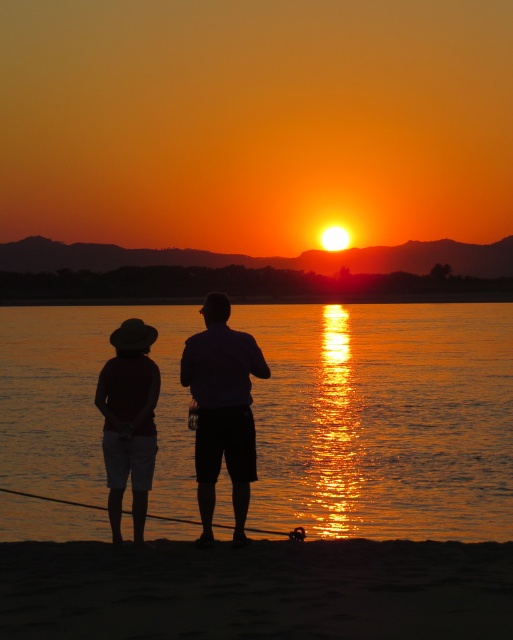
Question: Does matte black hat at lower left appear under metallic wire fishing pole at lower center?

Choices:
 (A) yes
 (B) no

Answer: (B)

Question: Which point is closer to the camera?

Choices:
 (A) matte purple shirt at center
 (B) metallic wire fishing pole at lower center
 (C) glistening water at center

Answer: (A)

Question: Can you confirm if glistening water at center is wider than matte purple shirt at center?

Choices:
 (A) yes
 (B) no

Answer: (A)

Question: Where is matte purple shirt at center located in relation to metallic wire fishing pole at lower center in the image?

Choices:
 (A) left
 (B) right

Answer: (B)

Question: Which of the following is the closest to the observer?

Choices:
 (A) (259, 490)
 (B) (351, 620)
 (C) (134, 384)
 (D) (243, 380)

Answer: (B)

Question: Considering the real-world distances, which object is closest to the matte black hat at lower left?

Choices:
 (A) dark sand at lower center
 (B) glistening water at center
 (C) matte purple shirt at center
 (D) metallic wire fishing pole at lower center

Answer: (C)